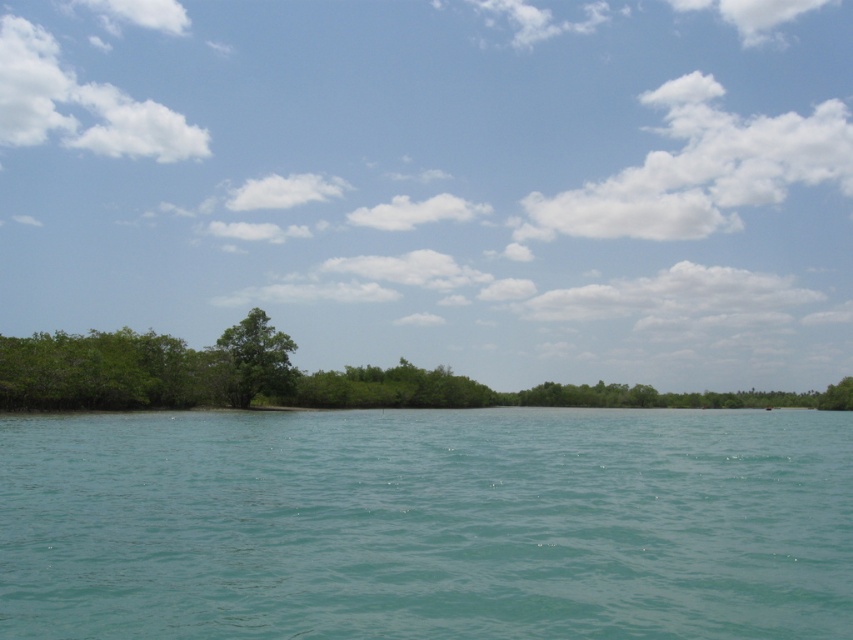
Can you confirm if teal water at center is positioned to the left of green leafy tree at center?

Incorrect, teal water at center is not on the left side of green leafy tree at center.

How distant is teal water at center from green leafy tree at center?

A distance of 81.54 feet exists between teal water at center and green leafy tree at center.

Is point (537, 496) positioned behind point (245, 401)?

No, (537, 496) is closer to viewer.

Find the location of a particular element. teal water at center is located at coordinates (426, 524).